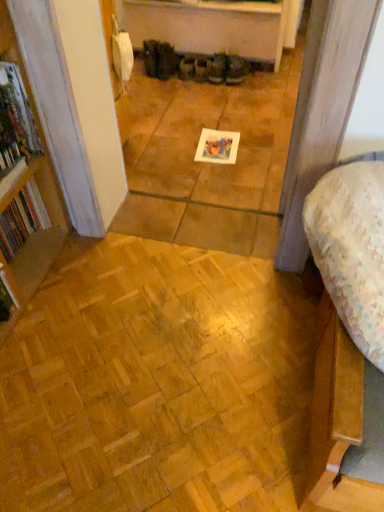
Question: Is hardcover book at left, which is the first book in back-to-front order, inside the boundaries of matte brown boot at center, or outside?

Choices:
 (A) inside
 (B) outside

Answer: (B)

Question: In the image, is hardcover book at left, the second book from the front, positioned in front of or behind matte brown boot at center?

Choices:
 (A) front
 (B) behind

Answer: (A)

Question: Which object is positioned closest to the hardcover book at left, the second book from the front?

Choices:
 (A) natural wood parquet floor at lower left
 (B) hardcover book at left, which ranks as the second book in back-to-front order
 (C) matte brown boot at center
 (D) floral fabric bed at lower right

Answer: (B)

Question: Estimate the real-world distances between objects in this image. Which object is farther from the hardcover book at left, arranged as the first book when viewed from the front?

Choices:
 (A) matte brown boot at center
 (B) hardcover book at left, the second book from the front
 (C) floral fabric bed at lower right
 (D) natural wood parquet floor at lower left

Answer: (A)